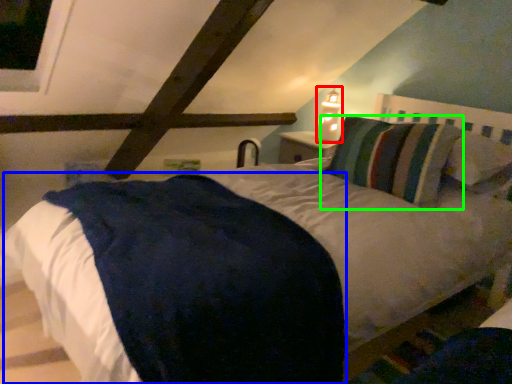
Question: Estimate the real-world distances between objects in this image. Which object is closer to bedside lamp (highlighted by a red box), mattress (highlighted by a blue box) or pillow (highlighted by a green box)?

Choices:
 (A) mattress
 (B) pillow

Answer: (B)